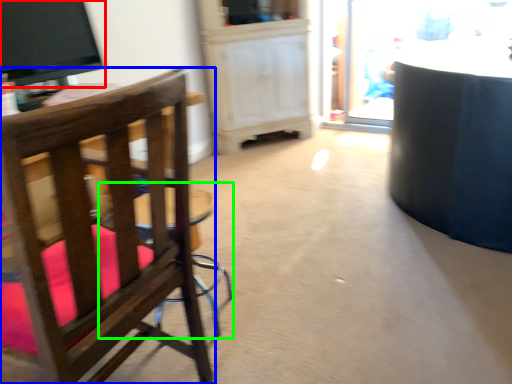
Question: Which is nearer to the television (highlighted by a red box)? chair (highlighted by a blue box) or bar stool (highlighted by a green box).

Choices:
 (A) chair
 (B) bar stool

Answer: (B)